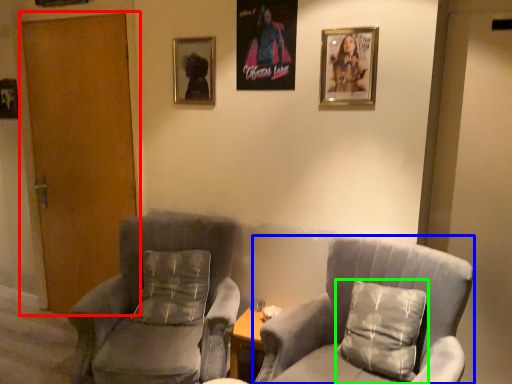
Question: Based on their relative distances, which object is farther from door (highlighted by a red box)? Choose from chair (highlighted by a blue box) and pillow (highlighted by a green box).

Choices:
 (A) chair
 (B) pillow

Answer: (B)